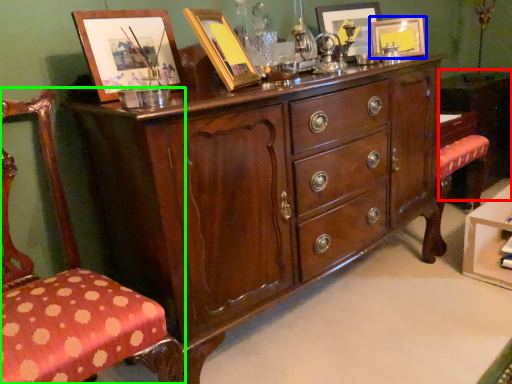
Question: Which object is the farthest from vanity (highlighted by a red box)? Choose among these: picture frame (highlighted by a blue box) or chair (highlighted by a green box).

Choices:
 (A) picture frame
 (B) chair

Answer: (B)